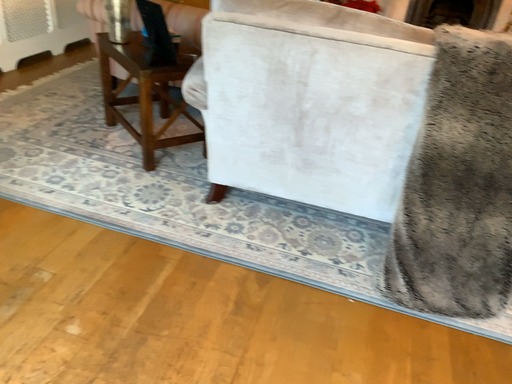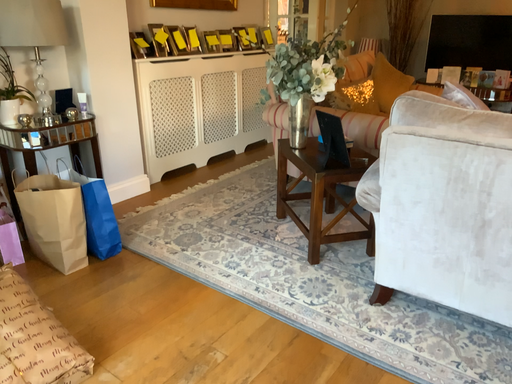
Question: How did the camera likely rotate when shooting the video?

Choices:
 (A) rotated left
 (B) rotated right

Answer: (A)